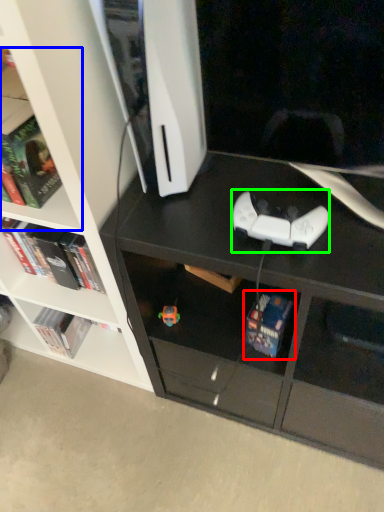
Question: Estimate the real-world distances between objects in this image. Which object is closer to book (highlighted by a red box), shelf (highlighted by a blue box) or game controller (highlighted by a green box)?

Choices:
 (A) shelf
 (B) game controller

Answer: (B)